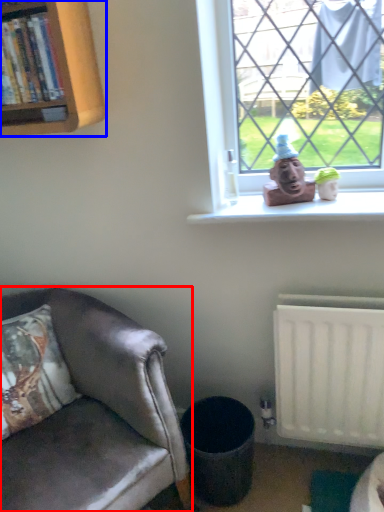
Question: Among these objects, which one is nearest to the camera, chair (highlighted by a red box) or bookcase (highlighted by a blue box)?

Choices:
 (A) chair
 (B) bookcase

Answer: (A)